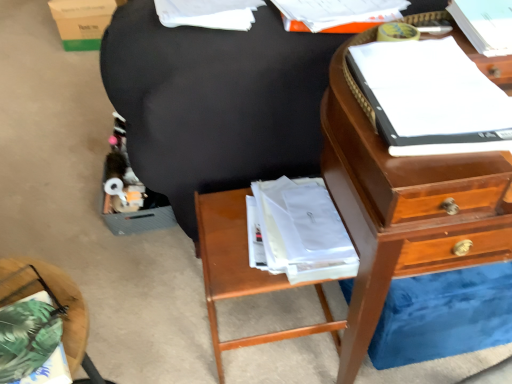
Image resolution: width=512 pixels, height=384 pixels. I want to click on blank space situated above wooden nightstand at lower center, which ranks as the second nightstand in left-to-right order (from a real-world perspective), so click(x=234, y=236).